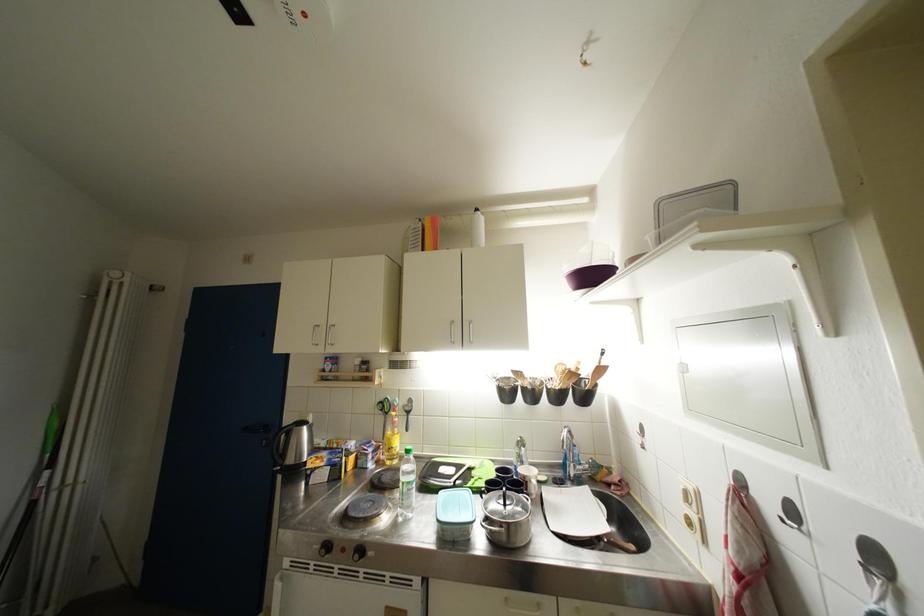
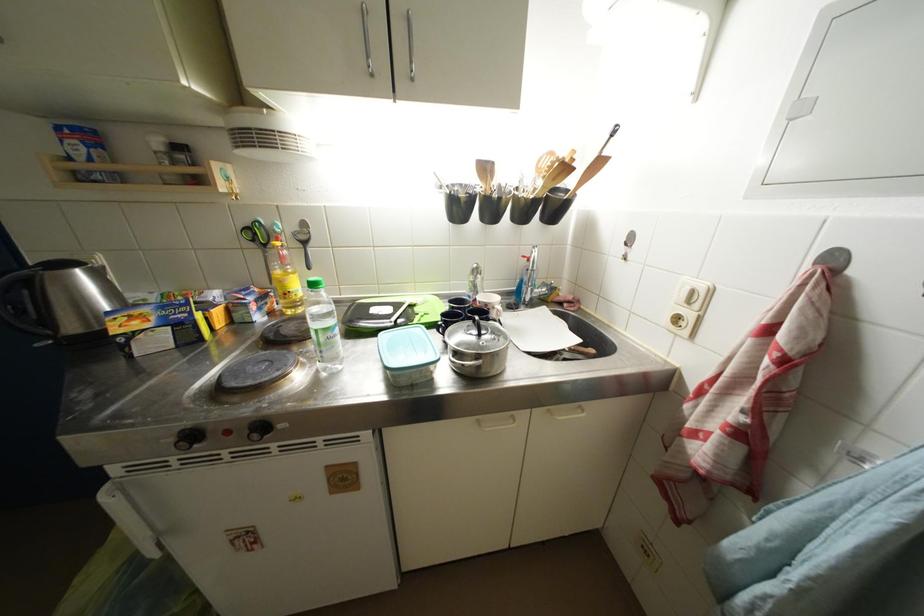
The images are taken continuously from a first-person perspective. In which direction is your viewpoint rotating?

The camera rotated toward right-down.